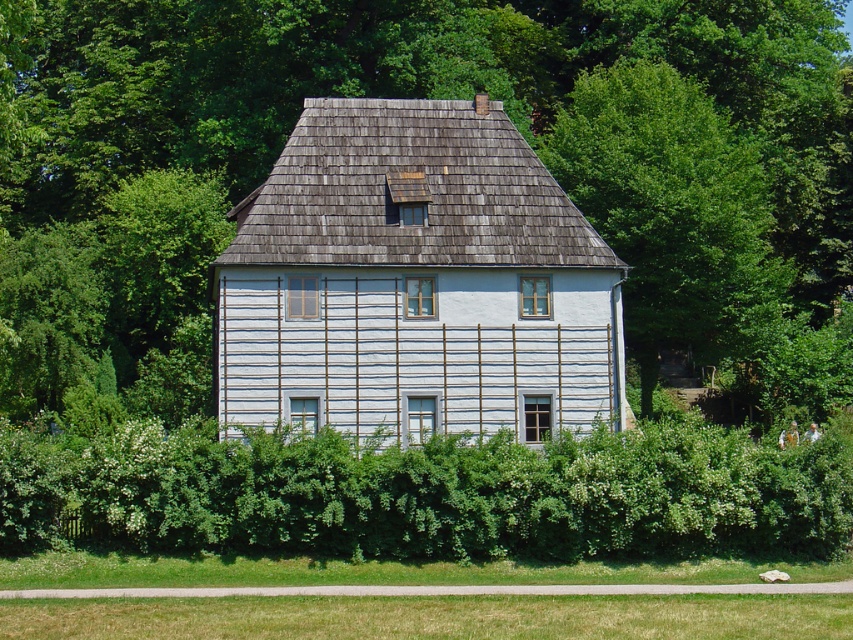
Can you confirm if green leafy tree at center is bigger than green leafy hedge at lower center?

Yes, green leafy tree at center is bigger than green leafy hedge at lower center.

Which of these two, green leafy tree at center or green leafy hedge at lower center, stands taller?

green leafy tree at center

Locate an element on the screen. The height and width of the screenshot is (640, 853). green leafy tree at center is located at coordinates (413, 97).